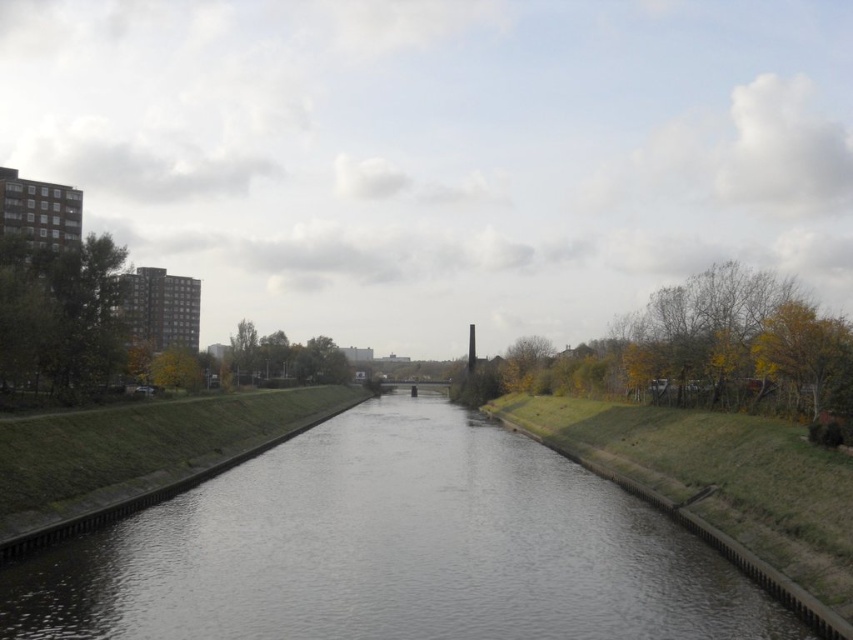
Can you confirm if gray concrete river at center is bigger than green leafy tree at left?

Indeed, gray concrete river at center has a larger size compared to green leafy tree at left.

Which is behind, point (165, 536) or point (0, 330)?

Point (0, 330)

This screenshot has width=853, height=640. In order to click on gray concrete river at center in this screenshot , I will do `click(392, 548)`.